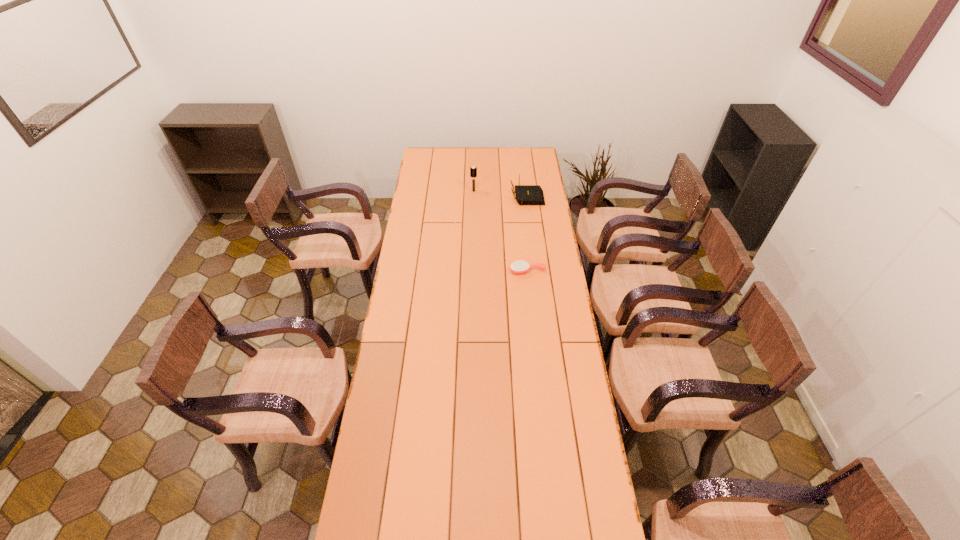
Find the location of a particular element. free space at the far edge of the desktop is located at coordinates (473, 148).

Locate an element on the screen. The width and height of the screenshot is (960, 540). free region at the left edge is located at coordinates (424, 292).

Find the location of a particular element. free point at the right edge is located at coordinates (549, 228).

Identify the location of vacant area at the far right corner. (537, 163).

What are the coordinates of `empty space between the second tallest object and the taller hairbrush` in the screenshot? It's located at (500, 194).

The image size is (960, 540). What are the coordinates of `free spot between the left hairbrush and the router` in the screenshot? It's located at (500, 194).

The image size is (960, 540). In order to click on vacant area that lies between the leftmost object and the second shortest object in this screenshot , I will do `click(500, 194)`.

At what (x,y) coordinates should I click in order to perform the action: click on free space between the nearest object and the leftmost object. Please return your answer as a coordinate pair (x, y). The image size is (960, 540). Looking at the image, I should click on (501, 231).

This screenshot has width=960, height=540. What are the coordinates of `vacant space that is in between the second shortest object and the right hairbrush` in the screenshot? It's located at (527, 234).

Find the location of `free space between the second shortest object and the taller hairbrush`. free space between the second shortest object and the taller hairbrush is located at coordinates 500,194.